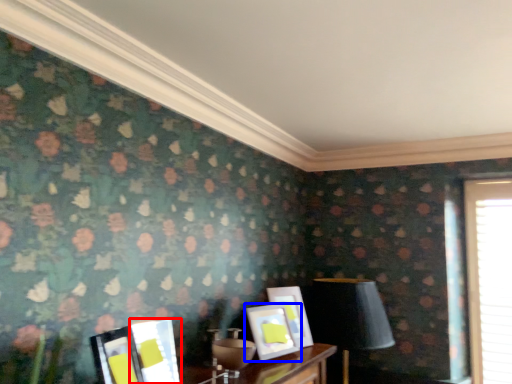
Question: Which of the following is the farthest to the observer, picture frame (highlighted by a red box) or picture frame (highlighted by a blue box)?

Choices:
 (A) picture frame
 (B) picture frame

Answer: (B)